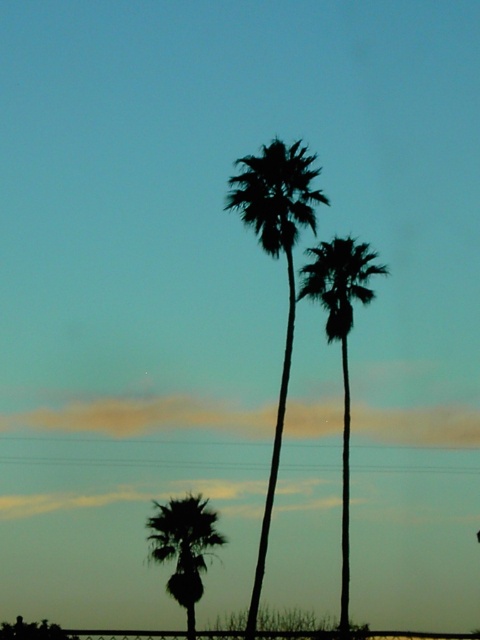
You are standing in front of the palm trees scene and want to know which of the two points, point (263, 554) or point (338, 330), is nearer to you. Can you determine this based on the scene?

Point (263, 554) is closer to the camera than point (338, 330), so it is nearer to you.

From the picture: You are a photographer trying to capture the silhouette leafy palm at center and the silhouette palm at lower left in a single frame. Based on their positions, which palm tree should you adjust your camera to focus on first to ensure both are in the frame?

The silhouette palm at lower left should be focused on first since the silhouette leafy palm at center is positioned to its right, meaning the lower left palm is closer to the camera and would need to be centered first to include both in the frame.

What are the coordinates of the silhouette leafy palm at center?

The silhouette leafy palm at center is located at coordinates point (287, 269).